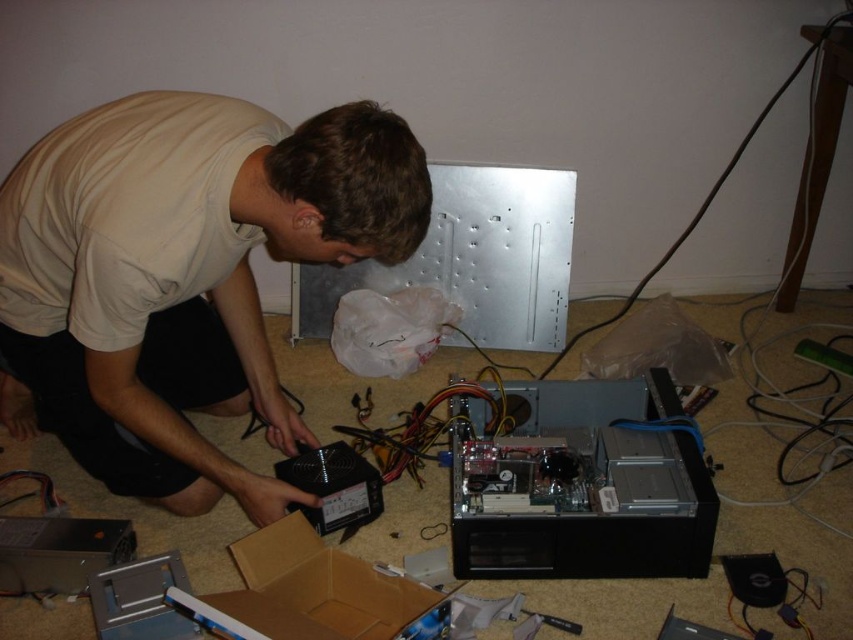
You are helping someone assemble a computer. You see the black plastic power supply at center and the brown cardboard box at lower center. Which object is larger?

The black plastic power supply at center is bigger than the brown cardboard box at lower center.

You are a technician trying to locate the black plastic power supply at center in the image. What are the coordinates of its position?

The black plastic power supply at center is located at coordinates (184, 275).